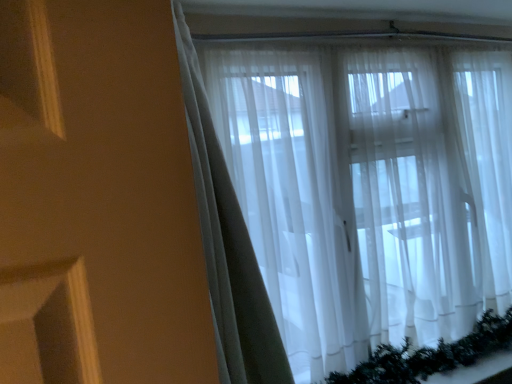
Image resolution: width=512 pixels, height=384 pixels. Describe the element at coordinates (362, 198) in the screenshot. I see `sheer white curtain at upper center` at that location.

I want to click on sheer white curtain at upper center, so click(x=362, y=198).

The width and height of the screenshot is (512, 384). Find the location of `sheer white curtain at upper center`. sheer white curtain at upper center is located at coordinates (362, 198).